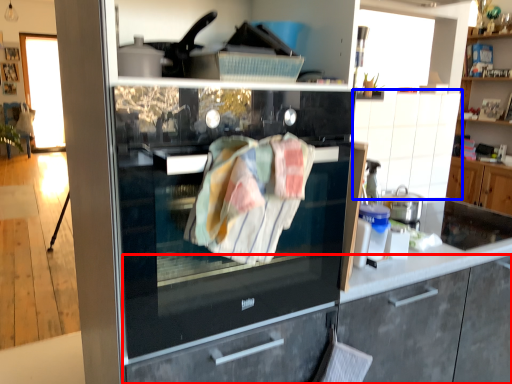
Question: Which of the following is the closest to the observer, cabinetry (highlighted by a red box) or cabinetry (highlighted by a blue box)?

Choices:
 (A) cabinetry
 (B) cabinetry

Answer: (A)